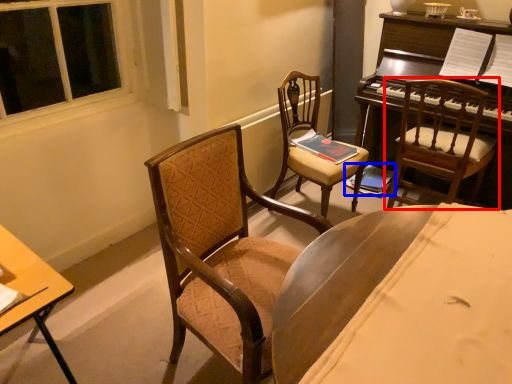
Question: Among these objects, which one is nearest to the camera, chair (highlighted by a red box) or book (highlighted by a blue box)?

Choices:
 (A) chair
 (B) book

Answer: (A)